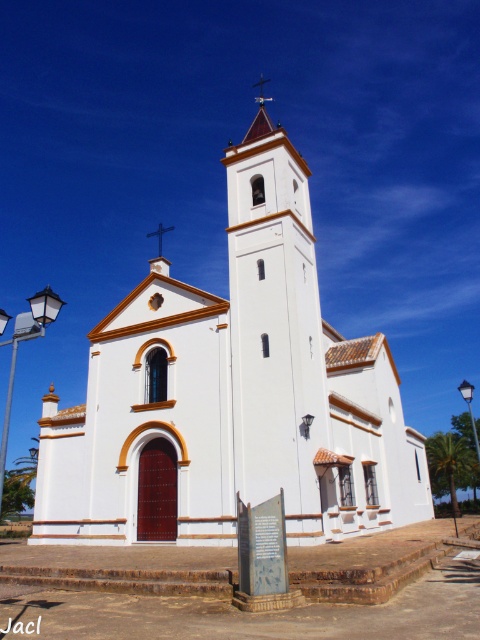
Is point (249, 182) in front of point (300, 256)?

That is False.

Who is more distant from viewer, (88, 381) or (229, 168)?

Positioned behind is point (88, 381).

Where is `white matte church at center`? This screenshot has width=480, height=640. white matte church at center is located at coordinates (231, 394).

Which is in front, point (415, 502) or point (162, 234)?

Point (415, 502)

Is white matte church at center positioned before black metal cross at upper center?

Yes, it is.

What do you see at coordinates (231, 394) in the screenshot? The image size is (480, 640). I see `white matte church at center` at bounding box center [231, 394].

At what (x,y) coordinates should I click in order to perform the action: click on white matte church at center. Please return your answer as a coordinate pair (x, y). Image resolution: width=480 pixels, height=640 pixels. Looking at the image, I should click on (231, 394).

Does metallic streetlight at upper right appear on the left side of black metal cross at upper center?

No, metallic streetlight at upper right is not to the left of black metal cross at upper center.

How distant is metallic streetlight at upper right from black metal cross at upper center?

A distance of 78.16 meters exists between metallic streetlight at upper right and black metal cross at upper center.

Is point (477, 442) farther from camera compared to point (160, 253)?

No, (477, 442) is closer to viewer.

Image resolution: width=480 pixels, height=640 pixels. In order to click on metallic streetlight at upper right in this screenshot , I will do `click(469, 410)`.